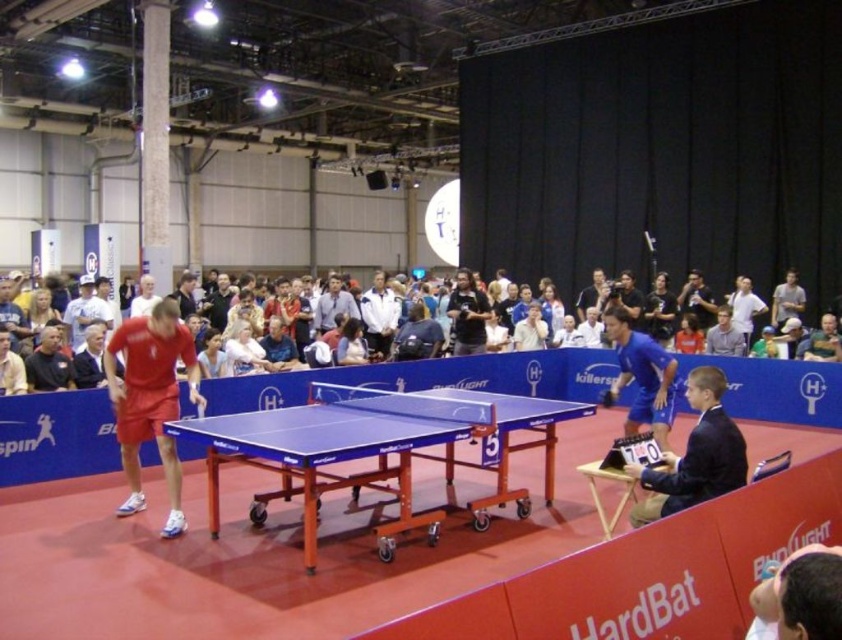
You are standing in the hall watching the table tennis match. The point marked at coordinates (647, 486) is part of the table tennis table. If you want to reach this point quickly, which direction should you move towards?

The point marked at coordinates (647, 486) is 4.61 meters away from the viewer. To reach it quickly, move directly toward the table tennis table since it is the closest object in that direction.

You are a photographer positioned at the back of the hall. You want to take a photo of the dark blue suit at right and the light gray fabric shirt at center such that both are visible in the frame. Based on their positions, which one should you focus on first to ensure both are in the shot?

Since the dark blue suit at right is to the left of the light gray fabric shirt at center, you should focus on the light gray fabric shirt at center first as it is further to the right, ensuring both are within the frame when adjusting the camera.